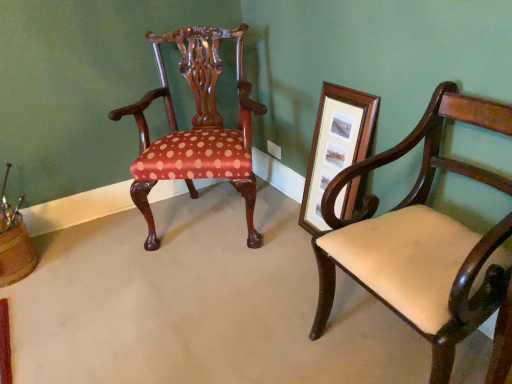
The height and width of the screenshot is (384, 512). In order to click on free location to the left of matte cream upholstered chair at right, which ranks as the 1th chair in front-to-back order in this screenshot , I will do `click(263, 332)`.